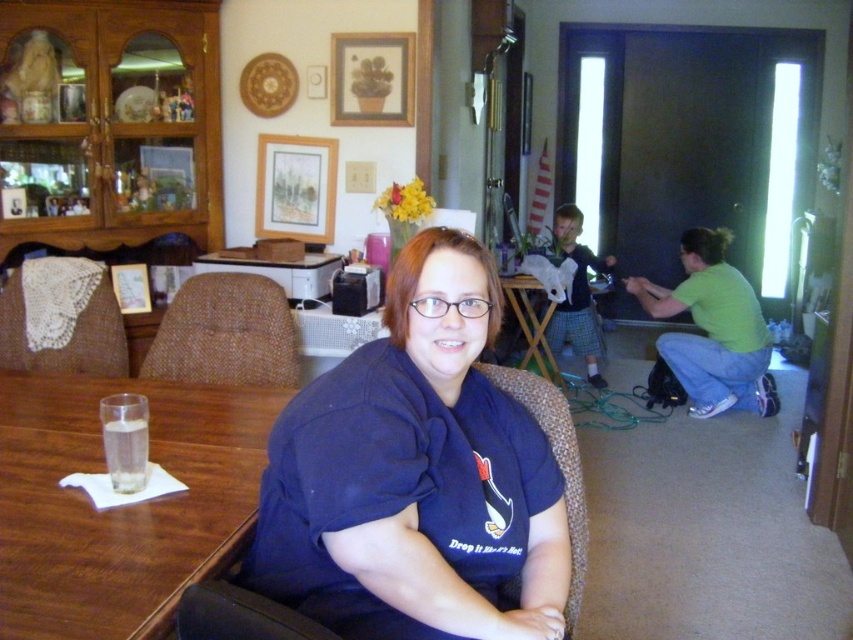
Is dark blue t-shirt at center above lace fabric chair at left?

No.

Is point (329, 561) positioned after point (26, 307)?

That is False.

This screenshot has height=640, width=853. I want to click on dark blue t-shirt at center, so click(x=415, y=474).

Between matte wooden picture frame at upper center and plaid fabric robe at center, which one is positioned higher?

Positioned higher is matte wooden picture frame at upper center.

Who is lower down, matte wooden picture frame at upper center or plaid fabric robe at center?

plaid fabric robe at center is below.

Is point (302, 182) farther from viewer compared to point (573, 339)?

No, (302, 182) is closer to viewer.

Where is `matte wooden picture frame at upper center`? This screenshot has height=640, width=853. matte wooden picture frame at upper center is located at coordinates (294, 188).

Between burlap-textured chair at center and lace fabric chair at left, which one appears on the right side from the viewer's perspective?

From the viewer's perspective, burlap-textured chair at center appears more on the right side.

Can you confirm if burlap-textured chair at center is taller than lace fabric chair at left?

Incorrect, burlap-textured chair at center's height is not larger of lace fabric chair at left's.

The height and width of the screenshot is (640, 853). What do you see at coordinates (225, 333) in the screenshot?
I see `burlap-textured chair at center` at bounding box center [225, 333].

Locate an element on the screen. This screenshot has height=640, width=853. burlap-textured chair at center is located at coordinates (225, 333).